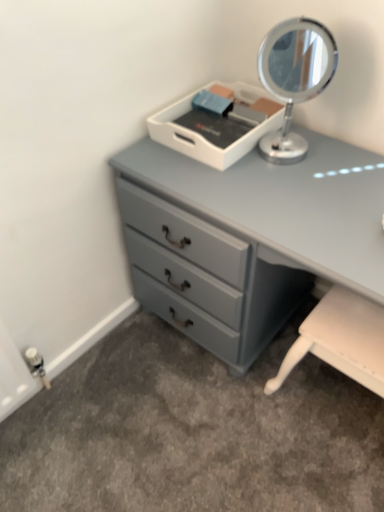
I want to click on vacant space to the left of silver metallic mirror at upper right, so click(x=216, y=175).